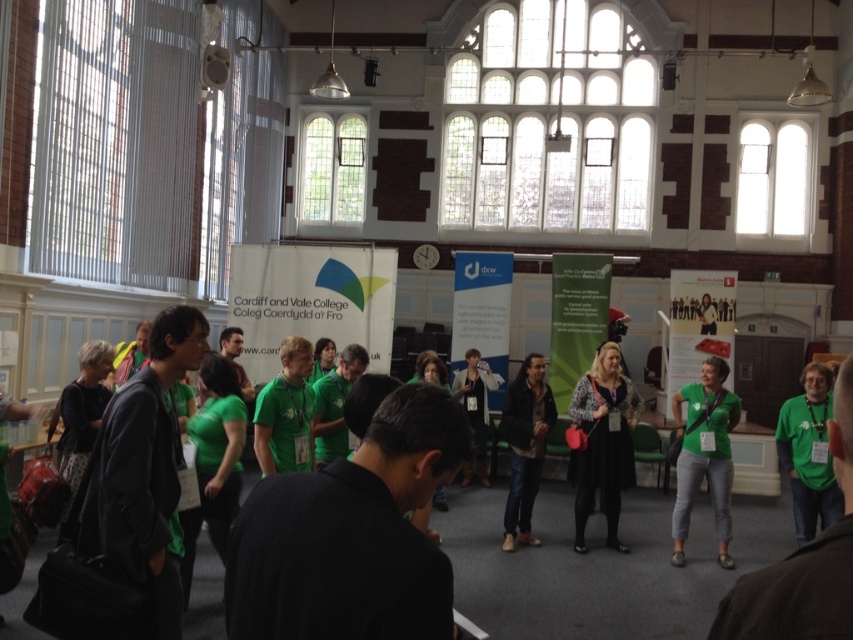
You are attending an indoor event and notice two items of clothing at the center of the scene. The leopard print sweater at center and the green matte shirt at center. Which one is covering the other?

The leopard print sweater at center is positioned over the green matte shirt at center, so it is covering the shirt.

Looking at this image, you are organizing a photo shoot in the hall and need to position two models wearing the leopard print sweater at center and the green matte shirt at center. The photographer requires a minimum distance of 36 inches between the models for the shot. Can the models maintain the required distance while standing at their current positions?

The leopard print sweater at center is 37.86 inches away from the green matte shirt at center. Since 37.86 inches exceeds the minimum required distance of 36 inches, the models can maintain the required distance while standing at their current positions.

Consider the image. You are organizing a photo shoot in the described hall and need to position two models wearing the leopard print sweater at center and the leather jacket at center. The photographer wants the models to stand exactly 30 inches apart. Based on their current positions, should you move them closer together or farther apart to meet the requirement?

The leopard print sweater at center is currently 29.37 inches away from the leather jacket at center. Since 29.37 inches is less than 30 inches, the models should move slightly farther apart to achieve the desired distance of 30 inches.